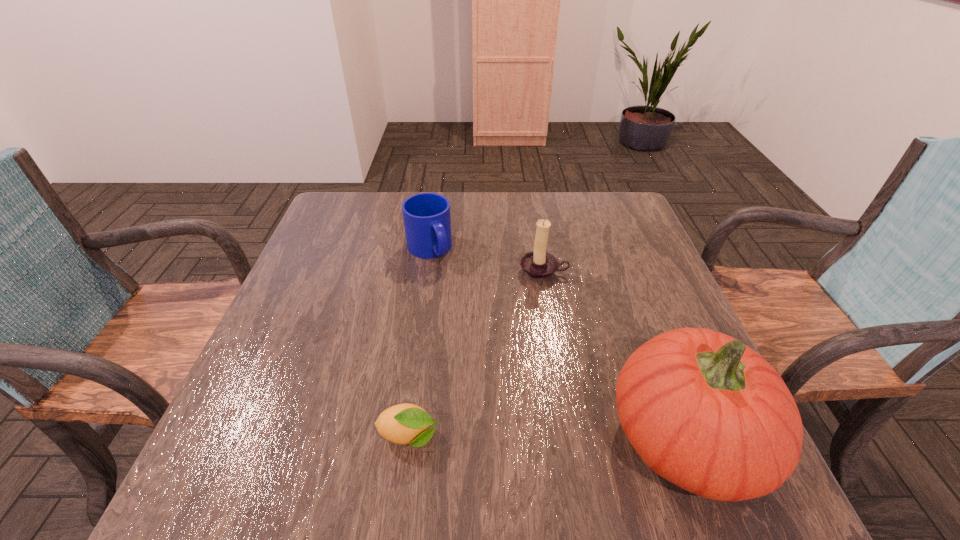
Identify the location of vacant space at the near edge of the desktop. (560, 441).

This screenshot has height=540, width=960. Find the location of `vacant space at the left edge`. vacant space at the left edge is located at coordinates (x=290, y=286).

Identify the location of vacant space at the right edge. (621, 258).

Where is `free space at the far left corner of the desktop`? The height and width of the screenshot is (540, 960). free space at the far left corner of the desktop is located at coordinates (330, 221).

You are a GUI agent. You are given a task and a screenshot of the screen. Output one action in this format:
    pyautogui.click(x=<x>, y=<y>)
    Task: Click on the vacant space at the near left corner of the desktop
    
    Given the screenshot: What is the action you would take?
    pyautogui.click(x=253, y=444)

In order to click on vacant space at the far right corner of the desktop in this screenshot , I will do `click(636, 218)`.

Locate an element on the screen. Image resolution: width=960 pixels, height=540 pixels. vacant space that is in between the second shortest object and the lemon is located at coordinates (419, 343).

Where is `free spot between the mug and the candle holder`? free spot between the mug and the candle holder is located at coordinates (486, 260).

At what (x,y) coordinates should I click in order to perform the action: click on free space between the tallest object and the candle holder. Please return your answer as a coordinate pair (x, y). This screenshot has height=540, width=960. Looking at the image, I should click on (615, 354).

The height and width of the screenshot is (540, 960). I want to click on free space between the tallest object and the second shortest object, so click(558, 343).